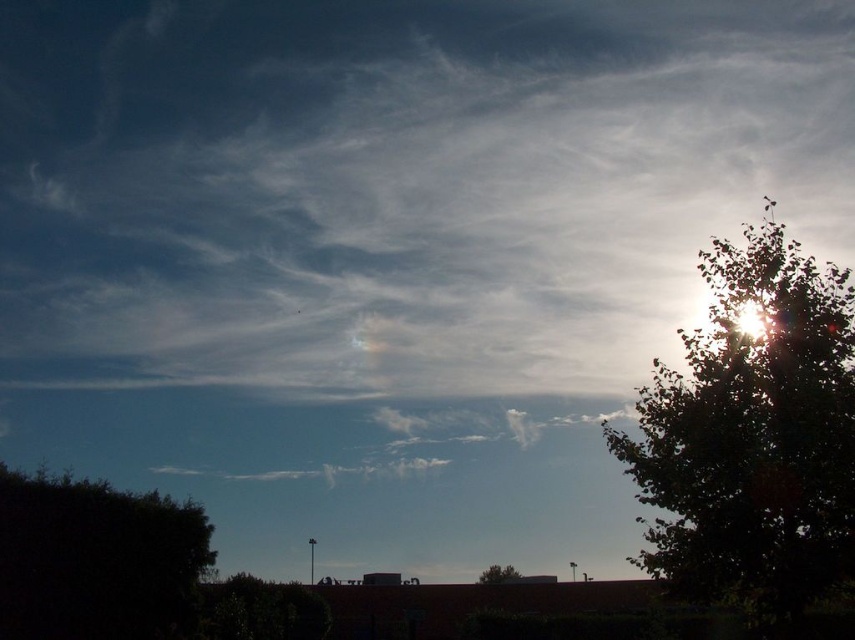
Question: Which point is closer to the camera?

Choices:
 (A) green leafy tree at lower center
 (B) green leafy tree at right

Answer: (B)

Question: Among these objects, which one is farthest from the camera?

Choices:
 (A) green leafy tree at lower center
 (B) green leafy tree at lower left

Answer: (A)

Question: Among these objects, which one is nearest to the camera?

Choices:
 (A) green leafy tree at lower left
 (B) green leafy tree at lower center

Answer: (A)

Question: Does green leafy tree at lower left lie behind green leafy tree at lower center?

Choices:
 (A) yes
 (B) no

Answer: (B)

Question: Is green leafy tree at lower left smaller than green leafy tree at lower center?

Choices:
 (A) no
 (B) yes

Answer: (A)

Question: Can you confirm if green leafy tree at right is bigger than green leafy tree at lower left?

Choices:
 (A) no
 (B) yes

Answer: (A)